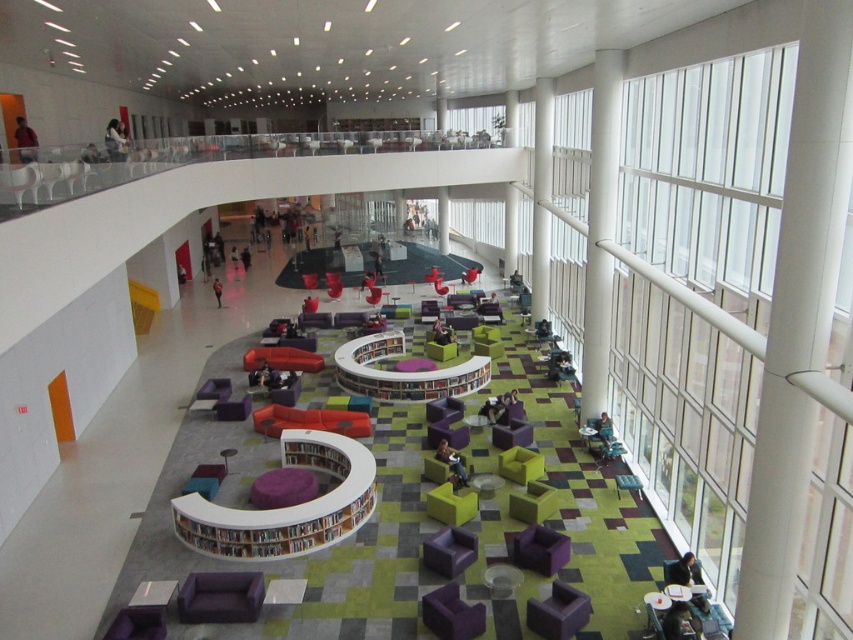
Can you confirm if matte black table at center is thinner than white smooth pillar at upper center?

Incorrect, matte black table at center's width is not less than white smooth pillar at upper center's.

Does matte black table at center have a greater width compared to white smooth pillar at upper center?

Indeed, matte black table at center has a greater width compared to white smooth pillar at upper center.

Measure the distance between point [334,266] and camera.

Point [334,266] is 119.87 feet from camera.

Locate an element on the screen. matte black table at center is located at coordinates (326, 266).

Between purple fabric couches at center and teal fabric chair at lower right, which one is positioned higher?

Positioned higher is purple fabric couches at center.

Which is more to the right, purple fabric couches at center or teal fabric chair at lower right?

Positioned to the right is teal fabric chair at lower right.

Between point (386, 554) and point (630, 477), which one is positioned in front?

Point (386, 554)

What are the coordinates of `purple fabric couches at center` in the screenshot? It's located at (302, 556).

Does point (305, 456) come closer to viewer compared to point (335, 291)?

Yes, it is.

Does white wood bookshelf at center appear on the right side of purple fabric chair at center?

Correct, you'll find white wood bookshelf at center to the right of purple fabric chair at center.

Identify the location of white wood bookshelf at center. (287, 506).

Locate an element on the screen. Image resolution: width=853 pixels, height=640 pixels. white wood bookshelf at center is located at coordinates (287, 506).